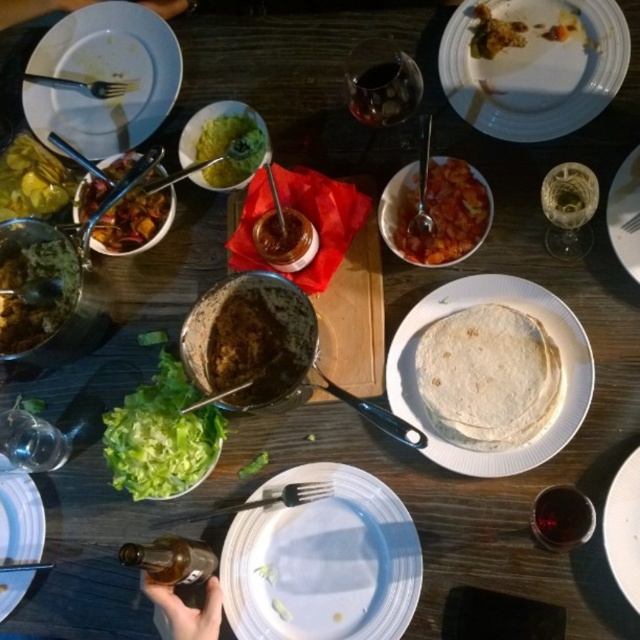
Between transparent glass at upper center and green matte guacamole at upper center, which one appears on the left side from the viewer's perspective?

green matte guacamole at upper center is more to the left.

Between transparent glass at upper center and green matte guacamole at upper center, which one is positioned lower?

Positioned lower is green matte guacamole at upper center.

The image size is (640, 640). What are the coordinates of `transparent glass at upper center` in the screenshot? It's located at (381, 83).

Is green matte salsa at lower left below shiny green pickles at upper left?

Yes, green matte salsa at lower left is below shiny green pickles at upper left.

Describe the element at coordinates (35, 291) in the screenshot. I see `green matte salsa at lower left` at that location.

Is point (51, 243) more distant than point (33, 186)?

No.

You are a GUI agent. You are given a task and a screenshot of the screen. Output one action in this format:
    pyautogui.click(x=<x>, y=<y>)
    Task: Click on the green matte salsa at lower left
    This screenshot has height=640, width=640.
    Given the screenshot: What is the action you would take?
    pyautogui.click(x=35, y=291)

At what (x,y) coordinates should I click in order to perform the action: click on white matte tortilla at center. Please return your answer as a coordinate pair (x, y). Looking at the image, I should click on click(548, 333).

Describe the element at coordinates (548, 333) in the screenshot. I see `white matte tortilla at center` at that location.

You are a GUI agent. You are given a task and a screenshot of the screen. Output one action in this format:
    pyautogui.click(x=<x>, y=<y>)
    Task: Click on the white matte tortilla at center
    
    Given the screenshot: What is the action you would take?
    pyautogui.click(x=548, y=333)